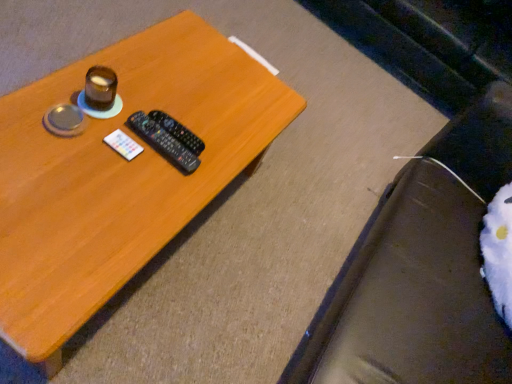
Where is `free space that is to the left of black plastic remote control at center, the 1th remote control viewed from the back`? free space that is to the left of black plastic remote control at center, the 1th remote control viewed from the back is located at coordinates (124, 89).